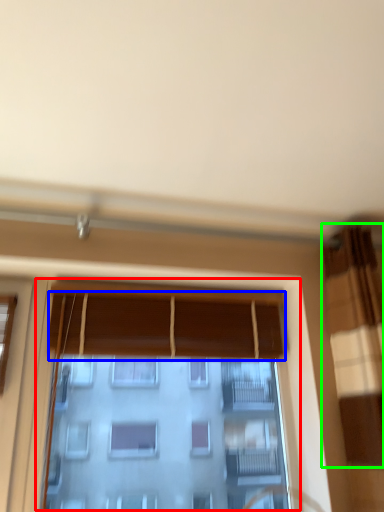
Question: Based on their relative distances, which object is nearer to window (highlighted by a red box)? Choose from curtain (highlighted by a blue box) and curtain (highlighted by a green box).

Choices:
 (A) curtain
 (B) curtain

Answer: (A)